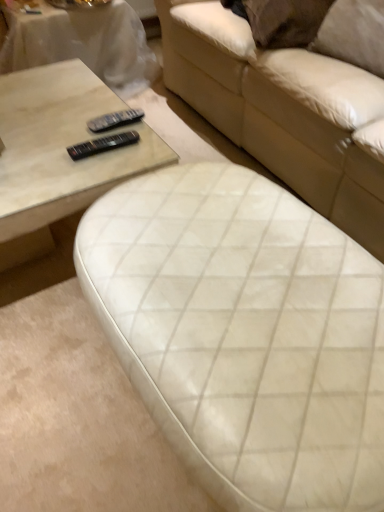
How much space does black plastic remote at upper center, which is the second remote in bottom-to-top order, occupy vertically?

It is 1.70 inches.

The image size is (384, 512). I want to click on matte glass coffee table at center, so click(x=61, y=146).

The image size is (384, 512). What do you see at coordinates (244, 334) in the screenshot? I see `white quilted leather ottoman at center, the 1th studio couch in the bottom-to-top sequence` at bounding box center [244, 334].

Find the location of `white quilted fabric studio couch at center, marked as the first studio couch in a top-to-bottom arrangement`. white quilted fabric studio couch at center, marked as the first studio couch in a top-to-bottom arrangement is located at coordinates (283, 111).

Considering the sizes of objects matte white coffee table at upper left and black plastic remote at center, which is counted as the 1th remote, starting from the bottom, in the image provided, who is smaller, matte white coffee table at upper left or black plastic remote at center, which is counted as the 1th remote, starting from the bottom,?

black plastic remote at center, which is counted as the 1th remote, starting from the bottom, is smaller.

Is matte white coffee table at upper left to the left of black plastic remote at center, which is counted as the 1th remote, starting from the bottom, from the viewer's perspective?

Correct, you'll find matte white coffee table at upper left to the left of black plastic remote at center, which is counted as the 1th remote, starting from the bottom.

What's the angular difference between matte white coffee table at upper left and black plastic remote at center, which is counted as the 1th remote, starting from the bottom,'s facing directions?

There is a 0.514-degree angle between the facing directions of matte white coffee table at upper left and black plastic remote at center, which is counted as the 1th remote, starting from the bottom.

Considering the sizes of objects matte white coffee table at upper left and black plastic remote at center, the second remote positioned from the top, in the image provided, who is taller, matte white coffee table at upper left or black plastic remote at center, the second remote positioned from the top,?

matte white coffee table at upper left is taller.

Is matte glass coffee table at center far away from white quilted fabric studio couch at center, which is the 2th studio couch in bottom-to-top order?

No, matte glass coffee table at center is not far away from white quilted fabric studio couch at center, which is the 2th studio couch in bottom-to-top order.

Between matte glass coffee table at center and white quilted fabric studio couch at center, marked as the first studio couch in a top-to-bottom arrangement, which one has larger width?

With larger width is white quilted fabric studio couch at center, marked as the first studio couch in a top-to-bottom arrangement.

Is matte glass coffee table at center inside the boundaries of white quilted fabric studio couch at center, marked as the first studio couch in a top-to-bottom arrangement, or outside?

matte glass coffee table at center is spatially situated outside white quilted fabric studio couch at center, marked as the first studio couch in a top-to-bottom arrangement.

Does point (62, 213) lie in front of point (381, 209)?

Yes, it is in front of point (381, 209).

Is white quilted fabric studio couch at center, marked as the first studio couch in a top-to-bottom arrangement, not near matte glass coffee table at center?

No, white quilted fabric studio couch at center, marked as the first studio couch in a top-to-bottom arrangement, is not far from matte glass coffee table at center.

Would you say white quilted fabric studio couch at center, which is the 2th studio couch in bottom-to-top order, is inside or outside matte glass coffee table at center?

white quilted fabric studio couch at center, which is the 2th studio couch in bottom-to-top order, is located beyond the bounds of matte glass coffee table at center.

From a real-world perspective, is white quilted fabric studio couch at center, which is the 2th studio couch in bottom-to-top order, above or below matte glass coffee table at center?

In terms of real-world spatial position, white quilted fabric studio couch at center, which is the 2th studio couch in bottom-to-top order, is above matte glass coffee table at center.

Can you tell me how much white quilted fabric studio couch at center, marked as the first studio couch in a top-to-bottom arrangement, and matte glass coffee table at center differ in facing direction?

90.5 degrees separate the facing orientations of white quilted fabric studio couch at center, marked as the first studio couch in a top-to-bottom arrangement, and matte glass coffee table at center.

Based on their sizes in the image, would you say black plastic remote at upper center, acting as the 1th remote starting from the top, is bigger or smaller than white quilted fabric studio couch at center, marked as the first studio couch in a top-to-bottom arrangement?

In the image, black plastic remote at upper center, acting as the 1th remote starting from the top, appears to be smaller than white quilted fabric studio couch at center, marked as the first studio couch in a top-to-bottom arrangement.

Is black plastic remote at upper center, acting as the 1th remote starting from the top, oriented away from white quilted fabric studio couch at center, which is the 2th studio couch in bottom-to-top order?

black plastic remote at upper center, acting as the 1th remote starting from the top, is not turned away from white quilted fabric studio couch at center, which is the 2th studio couch in bottom-to-top order.

What's the angular difference between black plastic remote at upper center, acting as the 1th remote starting from the top, and white quilted fabric studio couch at center, marked as the first studio couch in a top-to-bottom arrangement,'s facing directions?

black plastic remote at upper center, acting as the 1th remote starting from the top, and white quilted fabric studio couch at center, marked as the first studio couch in a top-to-bottom arrangement, are facing 85.1 degrees away from each other.

In the image, there is a black plastic remote at upper center, which is the second remote in bottom-to-top order. Where is `studio couch above it (from the image's perspective)`? The width and height of the screenshot is (384, 512). studio couch above it (from the image's perspective) is located at coordinates (283, 111).

Would you consider white quilted leather ottoman at center, acting as the second studio couch starting from the top, to be distant from black plastic remote at upper center, acting as the 1th remote starting from the top?

white quilted leather ottoman at center, acting as the second studio couch starting from the top, is near black plastic remote at upper center, acting as the 1th remote starting from the top, not far away.

Could you tell me if white quilted leather ottoman at center, acting as the second studio couch starting from the top, is facing black plastic remote at upper center, which is the second remote in bottom-to-top order?

No, white quilted leather ottoman at center, acting as the second studio couch starting from the top, is not aimed at black plastic remote at upper center, which is the second remote in bottom-to-top order.

From a real-world perspective, is white quilted leather ottoman at center, the 1th studio couch in the bottom-to-top sequence, below black plastic remote at upper center, which is the second remote in bottom-to-top order?

Yes, from a real-world perspective, white quilted leather ottoman at center, the 1th studio couch in the bottom-to-top sequence, is beneath black plastic remote at upper center, which is the second remote in bottom-to-top order.

Is white quilted leather ottoman at center, acting as the second studio couch starting from the top, in front of black plastic remote at upper center, which is the second remote in bottom-to-top order?

Yes, white quilted leather ottoman at center, acting as the second studio couch starting from the top, is closer to the viewer.

Which object is further away from the camera taking this photo, black plastic remote at center, the second remote positioned from the top, or white quilted fabric studio couch at center, which is the 2th studio couch in bottom-to-top order?

black plastic remote at center, the second remote positioned from the top.

Is black plastic remote at center, which is counted as the 1th remote, starting from the bottom, next to white quilted fabric studio couch at center, which is the 2th studio couch in bottom-to-top order, and touching it?

No, black plastic remote at center, which is counted as the 1th remote, starting from the bottom, is not next to white quilted fabric studio couch at center, which is the 2th studio couch in bottom-to-top order.

Looking at this image, from their relative heights in the image, would you say black plastic remote at center, which is counted as the 1th remote, starting from the bottom, is taller or shorter than white quilted fabric studio couch at center, marked as the first studio couch in a top-to-bottom arrangement?

black plastic remote at center, which is counted as the 1th remote, starting from the bottom, is shorter than white quilted fabric studio couch at center, marked as the first studio couch in a top-to-bottom arrangement.

From the image's perspective, is black plastic remote at center, the second remote positioned from the top, above or below white quilted fabric studio couch at center, which is the 2th studio couch in bottom-to-top order?

From the image's perspective, black plastic remote at center, the second remote positioned from the top, appears below white quilted fabric studio couch at center, which is the 2th studio couch in bottom-to-top order.

I want to click on remote located on the right of black plastic remote at center, the second remote positioned from the top, so click(x=114, y=120).

Which object is thinner, black plastic remote at upper center, acting as the 1th remote starting from the top, or black plastic remote at center, which is counted as the 1th remote, starting from the bottom?

black plastic remote at center, which is counted as the 1th remote, starting from the bottom.

Can you tell me how much black plastic remote at upper center, acting as the 1th remote starting from the top, and black plastic remote at center, which is counted as the 1th remote, starting from the bottom, differ in facing direction?

The angle between the facing direction of black plastic remote at upper center, acting as the 1th remote starting from the top, and the facing direction of black plastic remote at center, which is counted as the 1th remote, starting from the bottom, is 5.44 degrees.

From the image's perspective, is black plastic remote at upper center, which is the second remote in bottom-to-top order, located beneath black plastic remote at center, which is counted as the 1th remote, starting from the bottom?

Incorrect, from the image's perspective, black plastic remote at upper center, which is the second remote in bottom-to-top order, is higher than black plastic remote at center, which is counted as the 1th remote, starting from the bottom.

Image resolution: width=384 pixels, height=512 pixels. What are the coordinates of `the 2nd remote above the matte white coffee table at upper left (from a real-world perspective)` in the screenshot? It's located at click(102, 145).

Where is `coffee table below the white quilted fabric studio couch at center, marked as the first studio couch in a top-to-bottom arrangement (from the image's perspective)`? coffee table below the white quilted fabric studio couch at center, marked as the first studio couch in a top-to-bottom arrangement (from the image's perspective) is located at coordinates (61, 146).

From the image, which object appears to be farther from matte white coffee table at upper left, white quilted fabric studio couch at center, which is the 2th studio couch in bottom-to-top order, or black plastic remote at upper center, acting as the 1th remote starting from the top?

black plastic remote at upper center, acting as the 1th remote starting from the top, is further to matte white coffee table at upper left.

Estimate the real-world distances between objects in this image. Which object is closer to matte glass coffee table at center, black plastic remote at center, the second remote positioned from the top, or white quilted fabric studio couch at center, marked as the first studio couch in a top-to-bottom arrangement?

black plastic remote at center, the second remote positioned from the top, is closer to matte glass coffee table at center.

Looking at the image, which one is located further to matte glass coffee table at center, white quilted leather ottoman at center, acting as the second studio couch starting from the top, or matte white coffee table at upper left?

matte white coffee table at upper left is further to matte glass coffee table at center.

Which object lies nearer to the anchor point black plastic remote at upper center, which is the second remote in bottom-to-top order, black plastic remote at center, the second remote positioned from the top, or white quilted fabric studio couch at center, which is the 2th studio couch in bottom-to-top order?

Based on the image, black plastic remote at center, the second remote positioned from the top, appears to be nearer to black plastic remote at upper center, which is the second remote in bottom-to-top order.

Looking at the image, which one is located closer to matte white coffee table at upper left, black plastic remote at upper center, acting as the 1th remote starting from the top, or black plastic remote at center, the second remote positioned from the top?

black plastic remote at upper center, acting as the 1th remote starting from the top, is closer to matte white coffee table at upper left.

When comparing their distances from black plastic remote at center, which is counted as the 1th remote, starting from the bottom, does white quilted leather ottoman at center, the 1th studio couch in the bottom-to-top sequence, or white quilted fabric studio couch at center, which is the 2th studio couch in bottom-to-top order, seem closer?

white quilted leather ottoman at center, the 1th studio couch in the bottom-to-top sequence, is closer to black plastic remote at center, which is counted as the 1th remote, starting from the bottom.

From the image, which object appears to be farther from white quilted fabric studio couch at center, marked as the first studio couch in a top-to-bottom arrangement, matte white coffee table at upper left or matte glass coffee table at center?

The object further to white quilted fabric studio couch at center, marked as the first studio couch in a top-to-bottom arrangement, is matte white coffee table at upper left.

Looking at the image, which one is located further to white quilted fabric studio couch at center, marked as the first studio couch in a top-to-bottom arrangement, black plastic remote at upper center, which is the second remote in bottom-to-top order, or white quilted leather ottoman at center, acting as the second studio couch starting from the top?

white quilted leather ottoman at center, acting as the second studio couch starting from the top, is positioned further to the anchor white quilted fabric studio couch at center, marked as the first studio couch in a top-to-bottom arrangement.

In order to click on remote between white quilted leather ottoman at center, acting as the second studio couch starting from the top, and black plastic remote at upper center, acting as the 1th remote starting from the top, in the front-back direction in this screenshot , I will do `click(102, 145)`.

At what (x,y) coordinates should I click in order to perform the action: click on remote between matte white coffee table at upper left and black plastic remote at center, the second remote positioned from the top, from top to bottom. Please return your answer as a coordinate pair (x, y). Image resolution: width=384 pixels, height=512 pixels. Looking at the image, I should click on click(x=114, y=120).

Find the location of `coffee table between matte white coffee table at upper left and white quilted leather ottoman at center, the 1th studio couch in the bottom-to-top sequence, in the vertical direction`. coffee table between matte white coffee table at upper left and white quilted leather ottoman at center, the 1th studio couch in the bottom-to-top sequence, in the vertical direction is located at coordinates (61, 146).

Find the location of `coffee table positioned between white quilted leather ottoman at center, the 1th studio couch in the bottom-to-top sequence, and black plastic remote at center, the second remote positioned from the top, from near to far`. coffee table positioned between white quilted leather ottoman at center, the 1th studio couch in the bottom-to-top sequence, and black plastic remote at center, the second remote positioned from the top, from near to far is located at coordinates (61, 146).